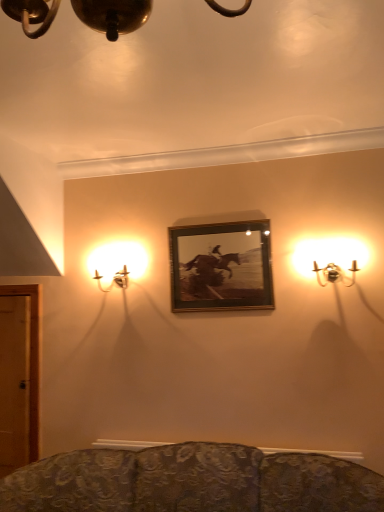
Question: Can you confirm if metallic gold sconce at left, which is the first lamp in left-to-right order, is smaller than metallic wall sconce at right, which appears as the 2th lamp when viewed from the back?

Choices:
 (A) yes
 (B) no

Answer: (B)

Question: Does metallic gold sconce at left, which is the first lamp in left-to-right order, have a larger size compared to metallic wall sconce at right, acting as the first lamp starting from the right?

Choices:
 (A) no
 (B) yes

Answer: (B)

Question: Is metallic gold sconce at left, arranged as the second lamp when viewed from the front, wider than metallic wall sconce at right, marked as the first lamp in a front-to-back arrangement?

Choices:
 (A) no
 (B) yes

Answer: (B)

Question: From a real-world perspective, is metallic gold sconce at left, which is the first lamp in left-to-right order, over metallic wall sconce at right, which appears as the 2th lamp when viewed from the back?

Choices:
 (A) no
 (B) yes

Answer: (B)

Question: Is metallic gold sconce at left, which is the first lamp in left-to-right order, positioned behind metallic wall sconce at right, which appears as the 2th lamp when viewed from the back?

Choices:
 (A) no
 (B) yes

Answer: (B)

Question: Looking at the image, does wooden frame at center seem bigger or smaller compared to metallic wall sconce at right, positioned as the second lamp in left-to-right order?

Choices:
 (A) big
 (B) small

Answer: (B)

Question: Is wooden frame at center spatially inside metallic wall sconce at right, which appears as the 2th lamp when viewed from the back, or outside of it?

Choices:
 (A) inside
 (B) outside

Answer: (B)

Question: Is wooden frame at center taller or shorter than metallic wall sconce at right, marked as the first lamp in a front-to-back arrangement?

Choices:
 (A) tall
 (B) short

Answer: (A)

Question: From the image's perspective, is wooden frame at center located above or below metallic wall sconce at right, acting as the first lamp starting from the right?

Choices:
 (A) below
 (B) above

Answer: (A)

Question: Is metallic wall sconce at right, which appears as the 2th lamp when viewed from the back, bigger or smaller than wooden frame at center?

Choices:
 (A) big
 (B) small

Answer: (A)

Question: In terms of height, does metallic wall sconce at right, acting as the first lamp starting from the right, look taller or shorter compared to wooden frame at center?

Choices:
 (A) tall
 (B) short

Answer: (B)

Question: Would you say metallic wall sconce at right, marked as the first lamp in a front-to-back arrangement, is to the left or to the right of wooden frame at center in the picture?

Choices:
 (A) left
 (B) right

Answer: (B)

Question: From the image's perspective, is metallic wall sconce at right, positioned as the second lamp in left-to-right order, positioned above or below wooden frame at center?

Choices:
 (A) above
 (B) below

Answer: (A)

Question: Is metallic gold sconce at left, which is the first lamp in left-to-right order, in front of or behind metallic wall sconce at right, positioned as the second lamp in left-to-right order, in the image?

Choices:
 (A) front
 (B) behind

Answer: (B)

Question: Does point (117, 276) appear closer or farther from the camera than point (306, 248)?

Choices:
 (A) closer
 (B) farther

Answer: (B)